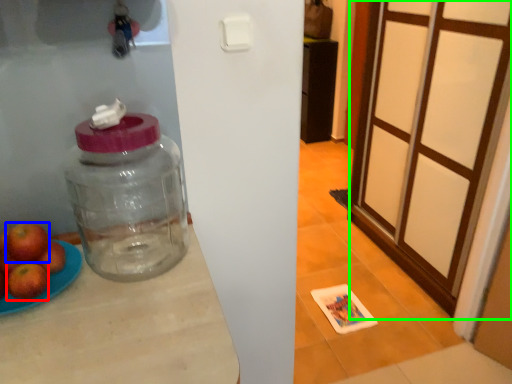
Question: Estimate the real-world distances between objects in this image. Which object is farther from apple (highlighted by a red box), apple (highlighted by a blue box) or screen door (highlighted by a green box)?

Choices:
 (A) apple
 (B) screen door

Answer: (B)